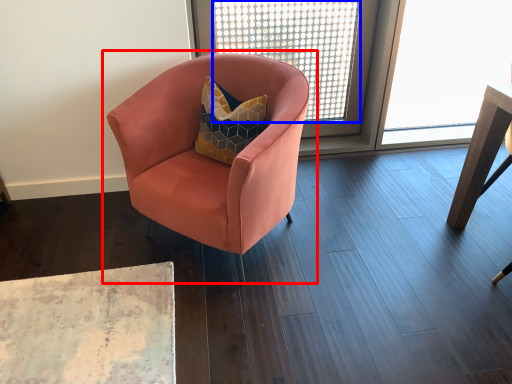
Question: Which point is closer to the camera, chair (highlighted by a red box) or window screen (highlighted by a blue box)?

Choices:
 (A) chair
 (B) window screen

Answer: (A)